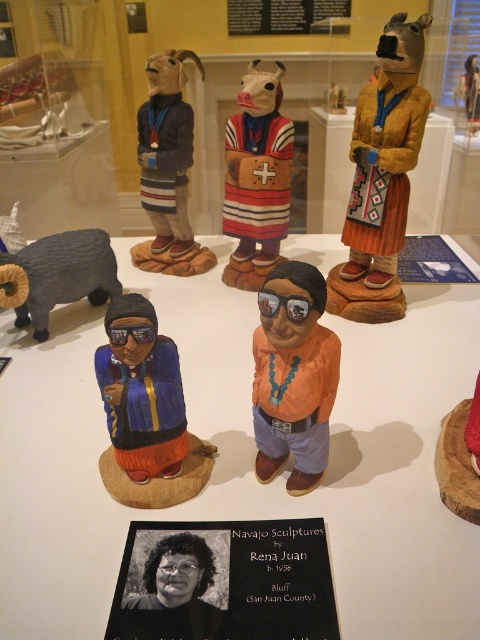
You are a visitor at the museum and want to take a photo of the white wood table at center and the matte brown kachina doll at upper right together in the same frame. The camera you are using has a maximum focus range of 25 inches. Can you capture both objects in focus without moving your position?

The distance between the white wood table at center and the matte brown kachina doll at upper right is 27.17 inches. Since the camera can only focus up to 25 inches, the objects are too far apart to be in focus simultaneously. You would need to adjust your position or use a different camera setting to capture both clearly.

You are an artist planning to sketch the scene. You need to decide whether to focus on the black paper at center or the matte black kachina doll at upper left first. Which object should you sketch first based on their widths?

The black paper at center might be wider than matte black kachina doll at upper left, so you should sketch the black paper at center first since it is wider and likely more prominent in the composition.

You are an art conservator examining the Navajo sculptures exhibit. You notice the black paper at center and the matte black kachina doll at upper left. Which object is closer to you from your viewing position?

The black paper at center is closer to you because it is positioned in front of the matte black kachina doll at upper left.